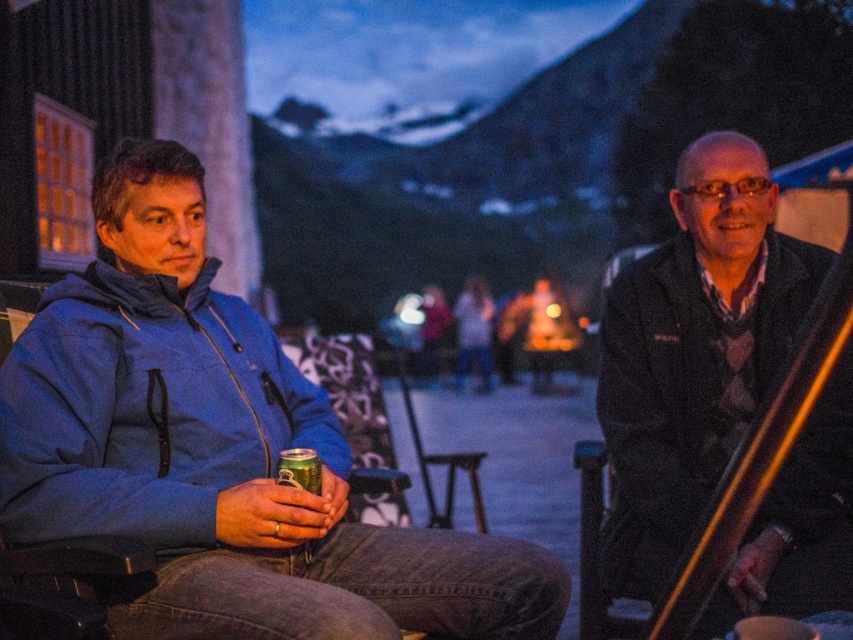
Based on the coordinates provided, which object is located at point (x=219, y=451)?

The point (x=219, y=451) corresponds to the blue fleece jacket at left.

You are at an evening event and want to find the blue fleece jacket at left and the matte white sweater at center. Which one is positioned more to the left side?

The blue fleece jacket at left is positioned more to the left side than the matte white sweater at center.